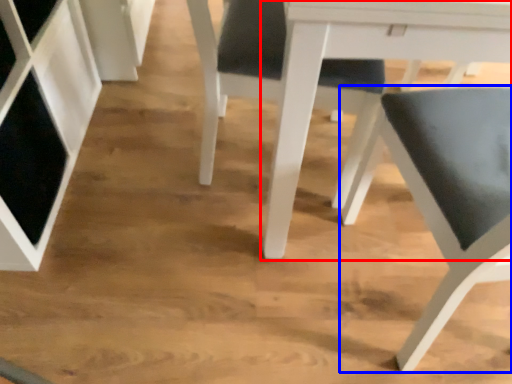
Question: Which of the following is the farthest to the observer, table (highlighted by a red box) or chair (highlighted by a blue box)?

Choices:
 (A) table
 (B) chair

Answer: (A)